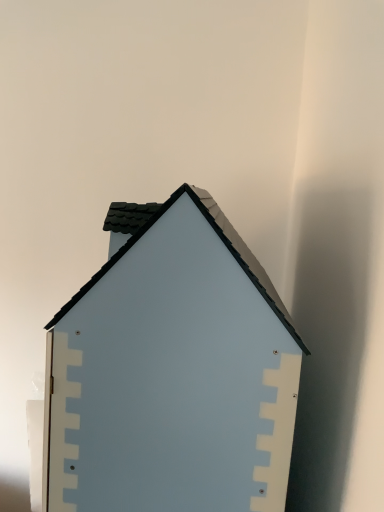
This screenshot has width=384, height=512. What do you see at coordinates (172, 372) in the screenshot?
I see `light blue matte wood beach hut at center` at bounding box center [172, 372].

In order to face light blue matte wood beach hut at center, should I rotate leftwards or rightwards?

Rotate your view left by about 2.219°.

I want to click on light blue matte wood beach hut at center, so click(172, 372).

The height and width of the screenshot is (512, 384). I want to click on light blue matte wood beach hut at center, so (172, 372).